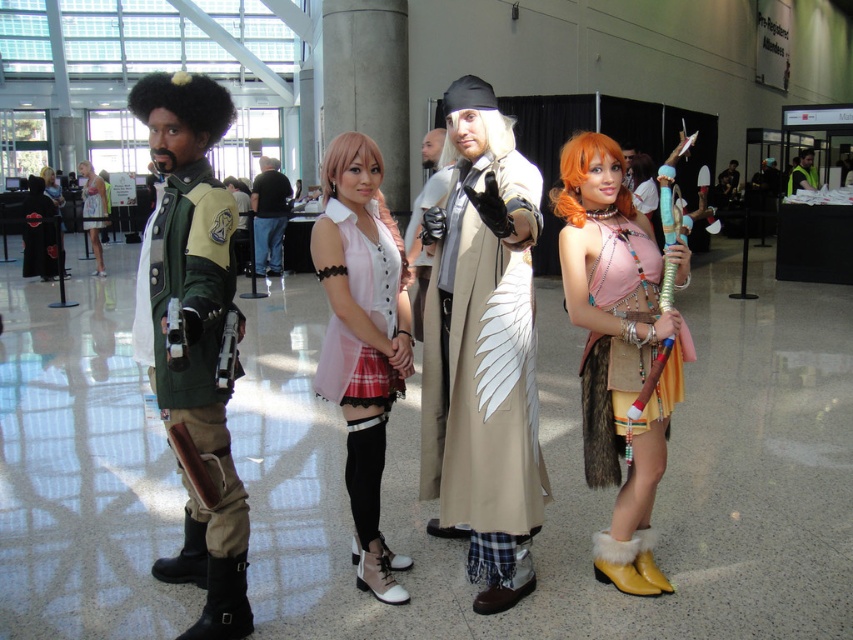
Looking at this image, you are an attendee at the convention and you want to take a photo with both the green fabric jacket at left and the black leather jacket at center. Since you can only focus on one at a time, which jacket should you aim your camera at first to capture both in the frame?

The green fabric jacket at left is to the right of the black leather jacket at center, so you should aim your camera at the black leather jacket at center first to ensure both are in the frame.